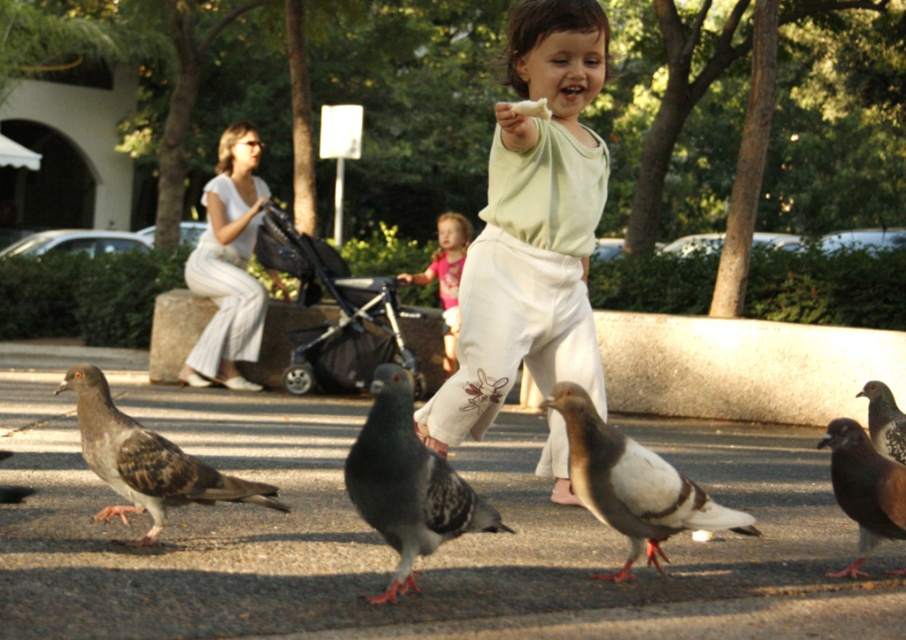
From the picture: Which is more to the left, gray asphalt at center or speckled feathered pigeon at center?

From the viewer's perspective, gray asphalt at center appears more on the left side.

Is gray asphalt at center to the left of speckled feathered pigeon at center from the viewer's perspective?

Correct, you'll find gray asphalt at center to the left of speckled feathered pigeon at center.

Where is `gray asphalt at center`? The width and height of the screenshot is (906, 640). gray asphalt at center is located at coordinates (389, 547).

The height and width of the screenshot is (640, 906). Identify the location of gray asphalt at center. (389, 547).

Can you confirm if gray speckled pigeon at lower left is wider than speckled feathered pigeon at center?

Indeed, gray speckled pigeon at lower left has a greater width compared to speckled feathered pigeon at center.

Based on the photo, is the position of gray speckled pigeon at lower left less distant than that of speckled feathered pigeon at center?

Yes, gray speckled pigeon at lower left is in front of speckled feathered pigeon at center.

What are the coordinates of `gray speckled pigeon at lower left` in the screenshot? It's located at (146, 460).

The image size is (906, 640). What do you see at coordinates (532, 228) in the screenshot?
I see `light green cotton shirt at center` at bounding box center [532, 228].

Is light green cotton shirt at center thinner than pink cotton shirt at center?

Incorrect, light green cotton shirt at center's width is not less than pink cotton shirt at center's.

I want to click on light green cotton shirt at center, so click(x=532, y=228).